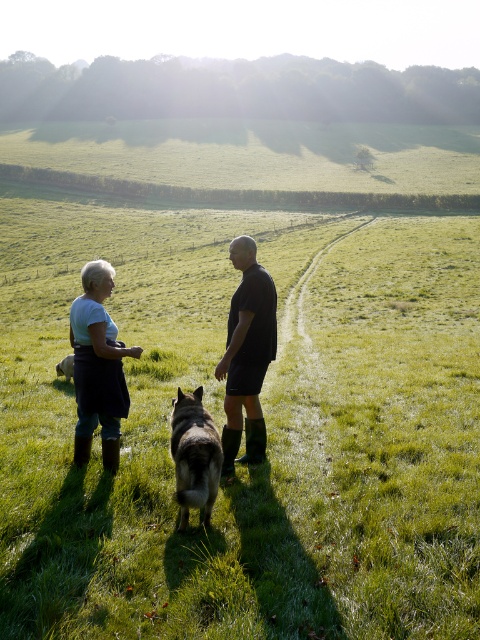
Question: Can you confirm if dark matte shirt at center is positioned to the right of brown fur dog at lower left?

Choices:
 (A) no
 (B) yes

Answer: (B)

Question: Based on their relative distances, which object is farther from the dark gray fur at center?

Choices:
 (A) brown fur dog at lower left
 (B) white cotton shirt at left
 (C) dark matte shirt at center

Answer: (A)

Question: Does dark matte shirt at center appear on the right side of white cotton shirt at left?

Choices:
 (A) yes
 (B) no

Answer: (A)

Question: Which point is farther from the camera taking this photo?

Choices:
 (A) (68, 365)
 (B) (96, 280)
 (C) (250, 445)

Answer: (A)

Question: Can you confirm if white cotton shirt at left is thinner than brown fur dog at lower left?

Choices:
 (A) yes
 (B) no

Answer: (A)

Question: Among these objects, which one is farthest from the camera?

Choices:
 (A) dark gray fur at center
 (B) brown fur dog at lower left
 (C) white cotton shirt at left

Answer: (B)